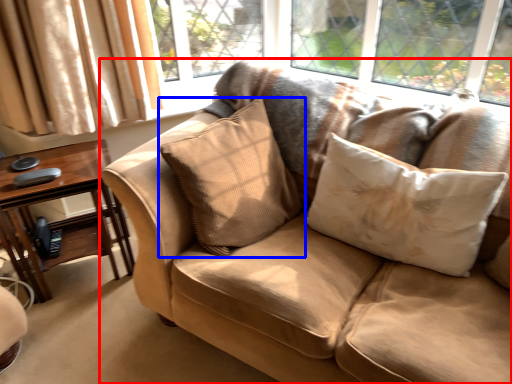
Question: Which of the following is the farthest to the observer, studio couch (highlighted by a red box) or pillow (highlighted by a blue box)?

Choices:
 (A) studio couch
 (B) pillow

Answer: (B)